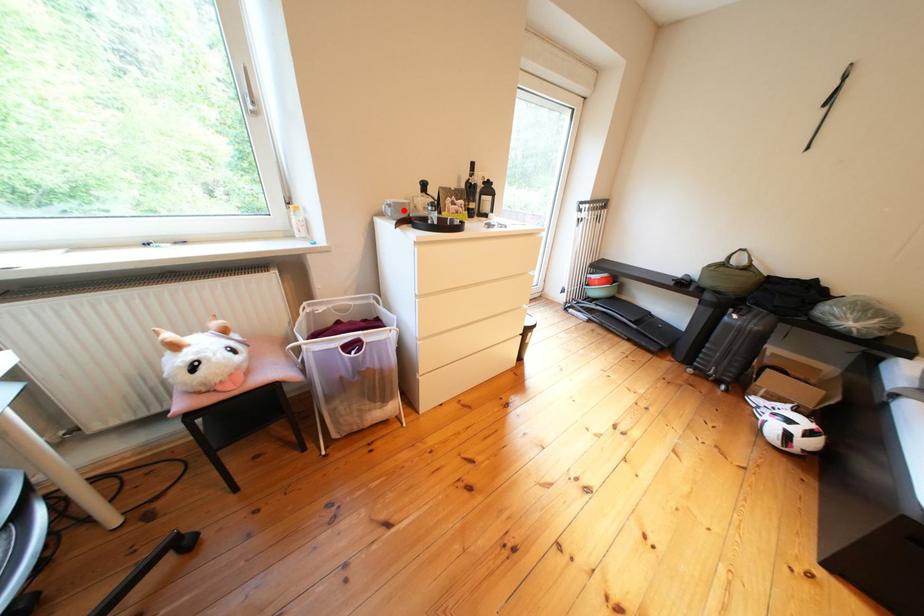
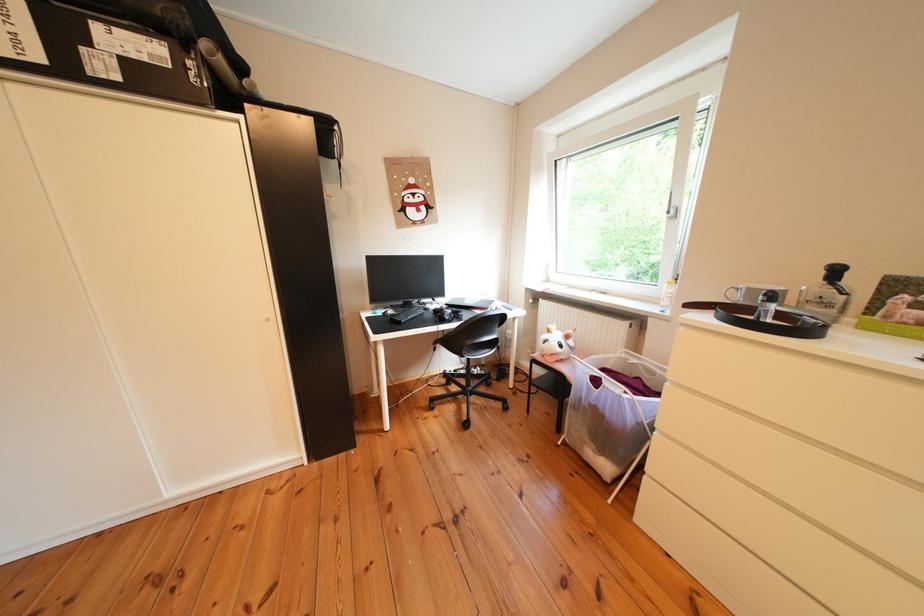
Where in the second image is the point corresponding to the highlighted location from the first image?

(751, 294)